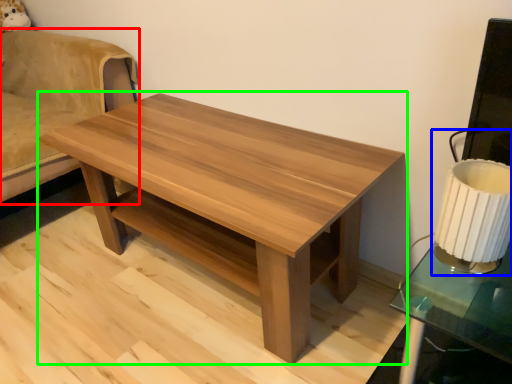
Question: Which is nearer to the swivel chair (highlighted by a red box)? table lamp (highlighted by a blue box) or coffee table (highlighted by a green box).

Choices:
 (A) table lamp
 (B) coffee table

Answer: (B)